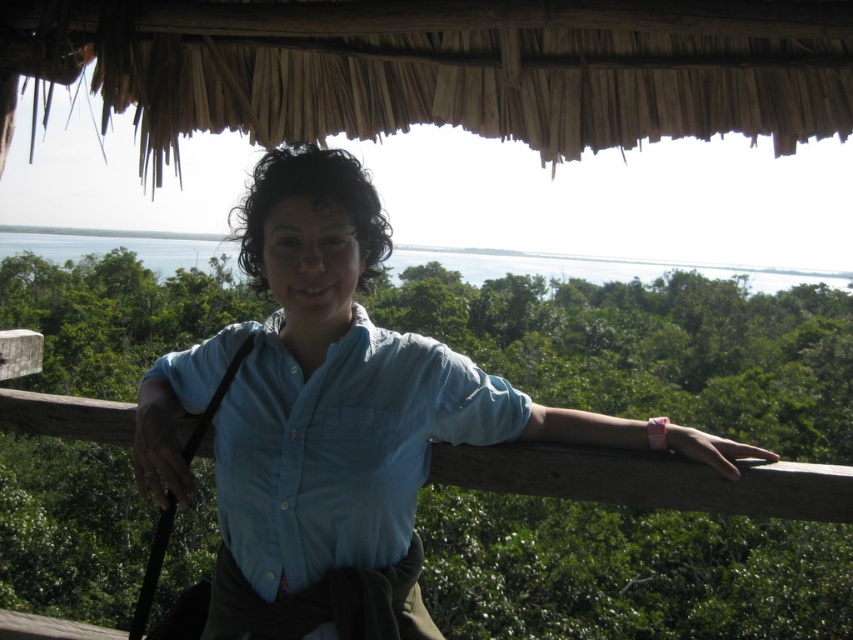
You are navigating a drone that needs to fly from point A to point B. Point A is at coordinates point (302, 456) and point B is at coordinates point (276, 369). According to the scene, which point is closer to the observer?

Point (302, 456) is in front of point (276, 369), so it is closer to the observer.